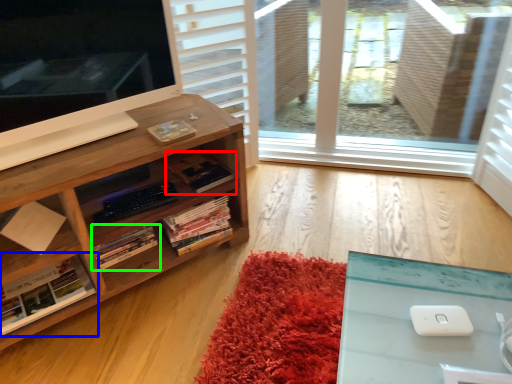
Question: Which is farther away from book (highlighted by a red box)? book (highlighted by a blue box) or book (highlighted by a green box)?

Choices:
 (A) book
 (B) book

Answer: (A)